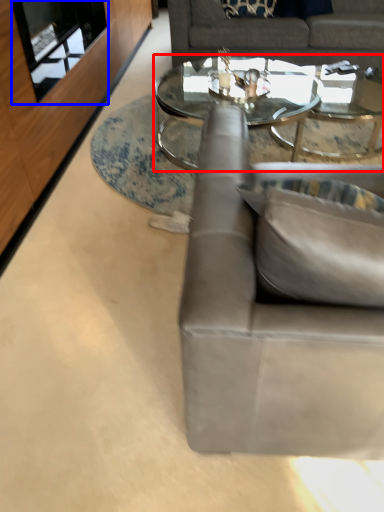
Question: Among these objects, which one is farthest to the camera, coffee table (highlighted by a red box) or glass door (highlighted by a blue box)?

Choices:
 (A) coffee table
 (B) glass door

Answer: (A)